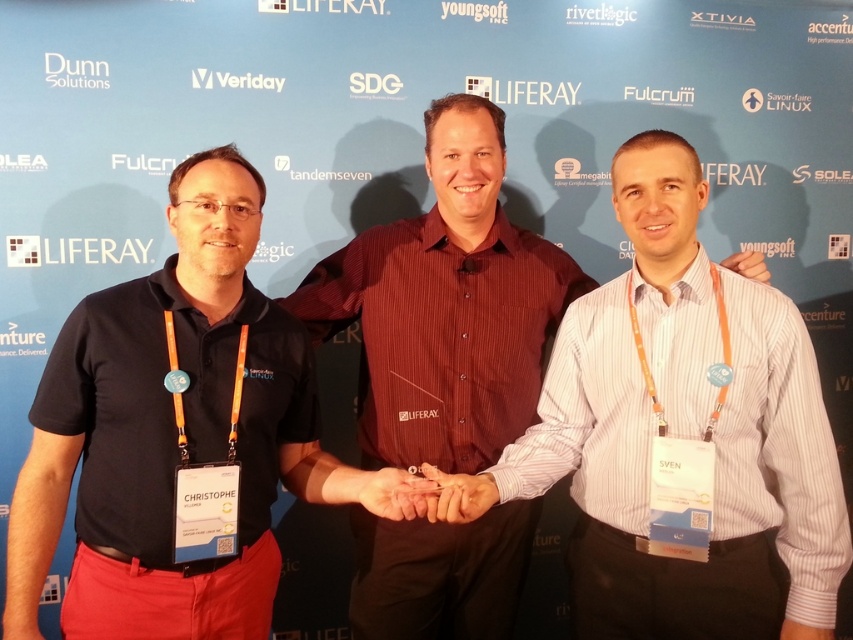
Question: Among these objects, which one is nearest to the camera?

Choices:
 (A) matte red shirt at center
 (B) black shirt at center

Answer: (B)

Question: Is black shirt at center above matte red shirt at center?

Choices:
 (A) no
 (B) yes

Answer: (A)

Question: Which of the following is the closest to the observer?

Choices:
 (A) (398, 465)
 (B) (157, 340)

Answer: (B)

Question: Considering the relative positions of black shirt at center and matte red shirt at center in the image provided, where is black shirt at center located with respect to matte red shirt at center?

Choices:
 (A) above
 (B) below

Answer: (B)

Question: Which of the following is the closest to the observer?

Choices:
 (A) black shirt at center
 (B) matte red shirt at center

Answer: (A)

Question: Can you confirm if black shirt at center is positioned to the left of matte red shirt at center?

Choices:
 (A) no
 (B) yes

Answer: (B)